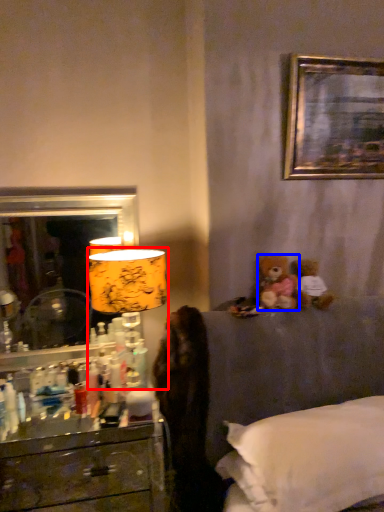
Question: Among these objects, which one is nearest to the camera, table lamp (highlighted by a red box) or teddy bear (highlighted by a blue box)?

Choices:
 (A) table lamp
 (B) teddy bear

Answer: (A)